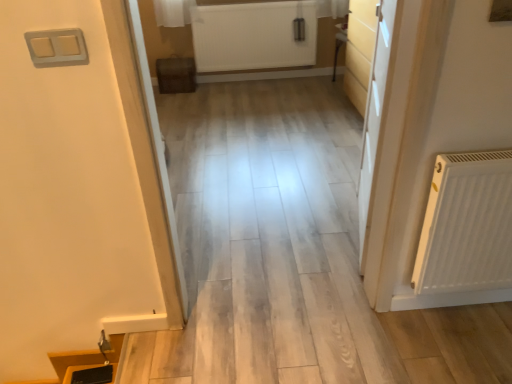
Question: From the image's perspective, is white matte radiator at upper center located beneath light wood door at right?

Choices:
 (A) no
 (B) yes

Answer: (A)

Question: From a real-world perspective, is white matte radiator at upper center beneath light wood door at right?

Choices:
 (A) no
 (B) yes

Answer: (B)

Question: Is white matte radiator at upper center facing towards light wood door at right?

Choices:
 (A) no
 (B) yes

Answer: (B)

Question: From a real-world perspective, is white matte radiator at upper center over light wood door at right?

Choices:
 (A) no
 (B) yes

Answer: (A)

Question: Does white matte radiator at upper center contain light wood door at right?

Choices:
 (A) yes
 (B) no

Answer: (B)

Question: From the image's perspective, is white matte radiator at upper center on light wood door at right?

Choices:
 (A) yes
 (B) no

Answer: (A)

Question: Considering the relative sizes of light wood door at right and white matte radiator at upper center in the image provided, is light wood door at right taller than white matte radiator at upper center?

Choices:
 (A) no
 (B) yes

Answer: (B)

Question: From a real-world perspective, does light wood door at right stand above white matte radiator at upper center?

Choices:
 (A) yes
 (B) no

Answer: (A)

Question: From a real-world perspective, is light wood door at right below white matte radiator at upper center?

Choices:
 (A) yes
 (B) no

Answer: (B)

Question: Considering the relative sizes of light wood door at right and white matte radiator at upper center in the image provided, is light wood door at right wider than white matte radiator at upper center?

Choices:
 (A) yes
 (B) no

Answer: (A)

Question: Would you say light wood door at right is outside white matte radiator at upper center?

Choices:
 (A) no
 (B) yes

Answer: (B)

Question: Considering the relative sizes of light wood door at right and white matte radiator at upper center in the image provided, is light wood door at right thinner than white matte radiator at upper center?

Choices:
 (A) yes
 (B) no

Answer: (B)

Question: From the image's perspective, is white matte radiator at upper center above or below light wood door at right?

Choices:
 (A) below
 (B) above

Answer: (B)